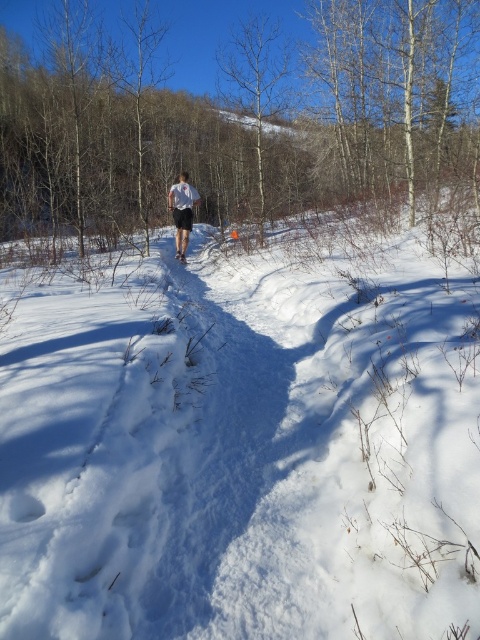
Between white fluffy snow at center and white matte shorts at center, which one is positioned lower?

Positioned lower is white fluffy snow at center.

Is point (299, 417) positioned after point (190, 228)?

No.

This screenshot has height=640, width=480. In order to click on white fluffy snow at center in this screenshot , I will do pyautogui.click(x=245, y=440).

Where is `white fluffy snow at center`? white fluffy snow at center is located at coordinates (245, 440).